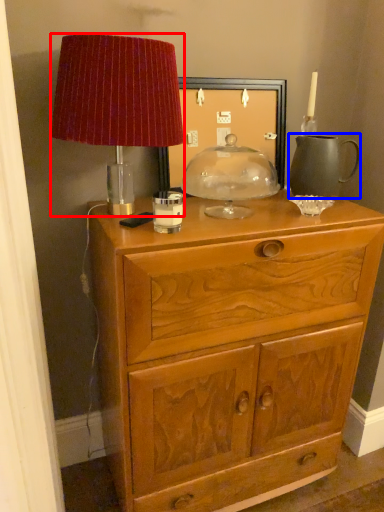
Question: Which point is further to the camera, lamp (highlighted by a red box) or tea pot (highlighted by a blue box)?

Choices:
 (A) lamp
 (B) tea pot

Answer: (B)